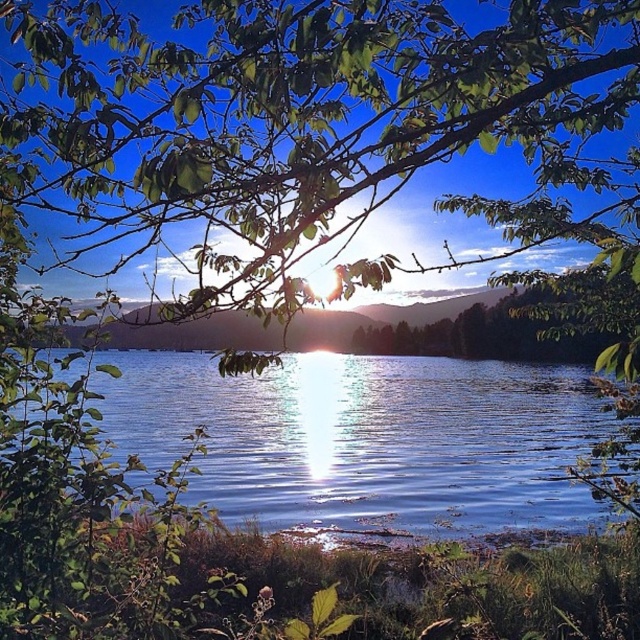
Question: Where is green leafy branches at upper center located in relation to glistening blue water at center in the image?

Choices:
 (A) left
 (B) right

Answer: (B)

Question: Which object appears farthest from the camera in this image?

Choices:
 (A) green leafy branches at upper center
 (B) glistening blue water at center

Answer: (B)

Question: Can you confirm if green leafy branches at upper center is bigger than glistening blue water at center?

Choices:
 (A) yes
 (B) no

Answer: (A)

Question: Can you confirm if green leafy branches at upper center is bigger than glistening blue water at center?

Choices:
 (A) yes
 (B) no

Answer: (A)

Question: Which of the following is the farthest from the observer?

Choices:
 (A) (246, 68)
 (B) (497, 522)

Answer: (B)

Question: Which object appears closest to the camera in this image?

Choices:
 (A) green leafy branches at upper center
 (B) glistening blue water at center

Answer: (A)